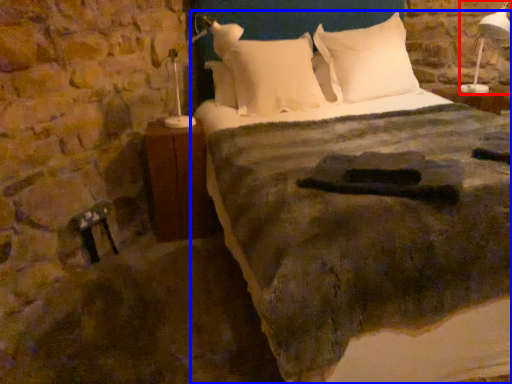
Question: Which object appears closest to the camera in this image, bedside lamp (highlighted by a red box) or bed (highlighted by a blue box)?

Choices:
 (A) bedside lamp
 (B) bed

Answer: (B)